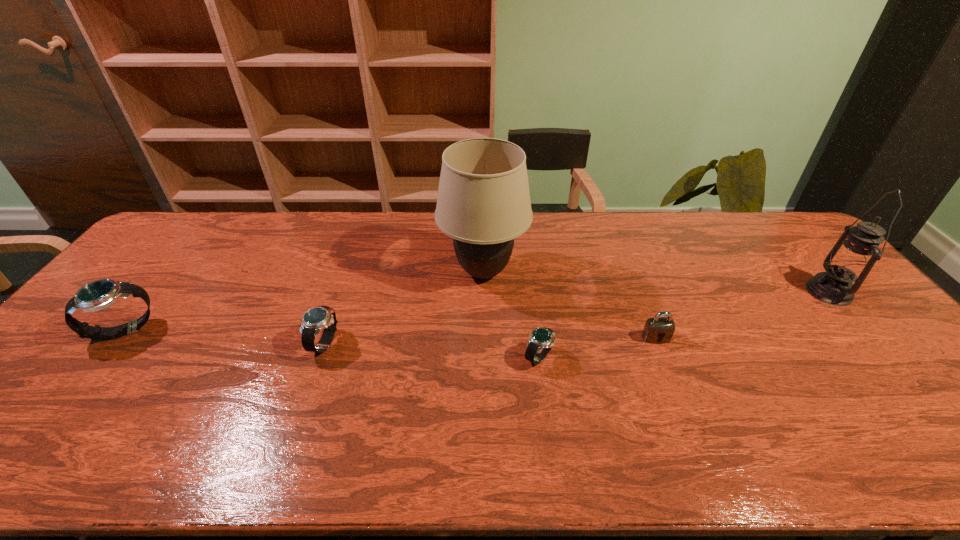
This screenshot has width=960, height=540. I want to click on the leftmost object, so click(x=100, y=294).

You are a GUI agent. You are given a task and a screenshot of the screen. Output one action in this format:
    pyautogui.click(x=<x>, y=<y>)
    Task: Click on the leftmost watch
    
    Given the screenshot: What is the action you would take?
    pyautogui.click(x=100, y=294)

Locate an element on the screen. the second watch from left to right is located at coordinates tap(315, 319).

I want to click on the fifth object from right to left, so click(315, 319).

Identify the location of the shortest watch. The width and height of the screenshot is (960, 540). (541, 340).

Where is `the rightmost watch`? The height and width of the screenshot is (540, 960). the rightmost watch is located at coordinates point(541,340).

The height and width of the screenshot is (540, 960). What are the coordinates of `oil lamp` in the screenshot? It's located at (851, 260).

The height and width of the screenshot is (540, 960). Find the location of `lampshade`. lampshade is located at coordinates (483, 203).

The width and height of the screenshot is (960, 540). I want to click on padlock, so click(658, 328).

In order to click on vacant space situated 0.080m on the back of the fourth shortest object in this screenshot , I will do `click(155, 295)`.